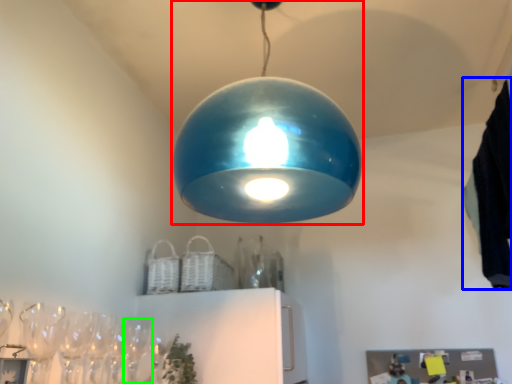
Question: Which is farther away from lamp (highlighted by a red box)? laundry (highlighted by a blue box) or wine glass (highlighted by a green box)?

Choices:
 (A) laundry
 (B) wine glass

Answer: (B)